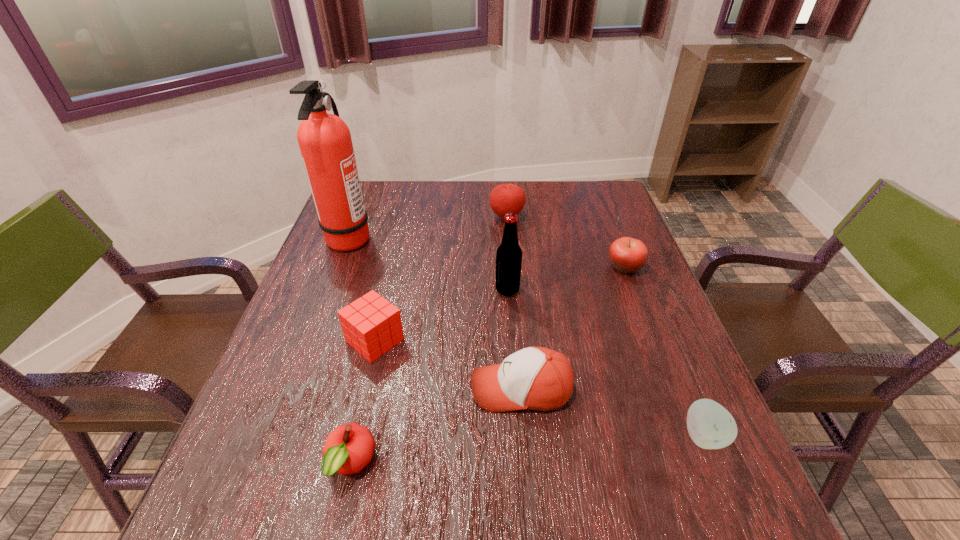
Find the location of a particular element. object identified as the closest to the leftmost object is located at coordinates (371, 325).

Select which apple appears as the closest to the sixth farthest object. Please provide its 2D coordinates. Your answer should be formatted as a tuple, i.e. [(x, y)], where the tuple contains the x and y coordinates of a point satisfying the conditions above.

[(348, 449)]

Find the location of `apple that is the third nearest to the leftmost apple`. apple that is the third nearest to the leftmost apple is located at coordinates (506, 198).

Locate an element on the screen. free spot that satisfies the following two spatial constraints: 1. on the handle side of the second farthest apple; 2. on the right side of the tallest object is located at coordinates (339, 267).

Locate an element on the screen. The height and width of the screenshot is (540, 960). vacant region that satisfies the following two spatial constraints: 1. on the back side of the beer bottle; 2. on the left side of the farthest apple is located at coordinates (502, 217).

Locate an element on the screen. vacant space that satisfies the following two spatial constraints: 1. on the handle side of the third nearest apple; 2. on the left side of the tallest object is located at coordinates (339, 267).

Find the location of a particular element. This screenshot has width=960, height=540. vacant space that satisfies the following two spatial constraints: 1. on the handle side of the tallest object; 2. on the back side of the fourth nearest object is located at coordinates (311, 340).

Locate an element on the screen. This screenshot has width=960, height=540. vacant position in the image that satisfies the following two spatial constraints: 1. on the handle side of the second farthest apple; 2. on the right side of the leftmost object is located at coordinates (339, 267).

Where is `free location that satisfies the following two spatial constraints: 1. on the handle side of the leftmost object; 2. on the back side of the fourth nearest object`? free location that satisfies the following two spatial constraints: 1. on the handle side of the leftmost object; 2. on the back side of the fourth nearest object is located at coordinates (311, 340).